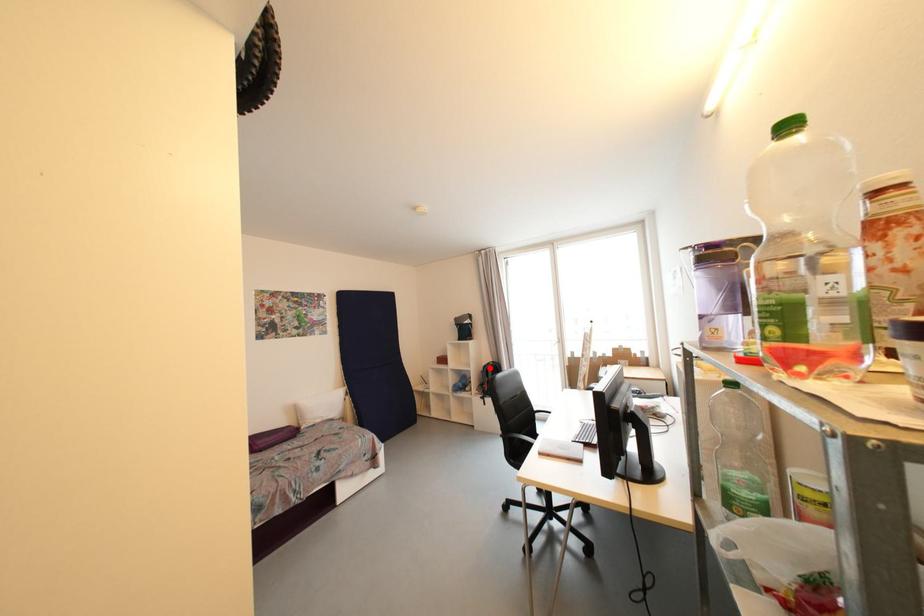
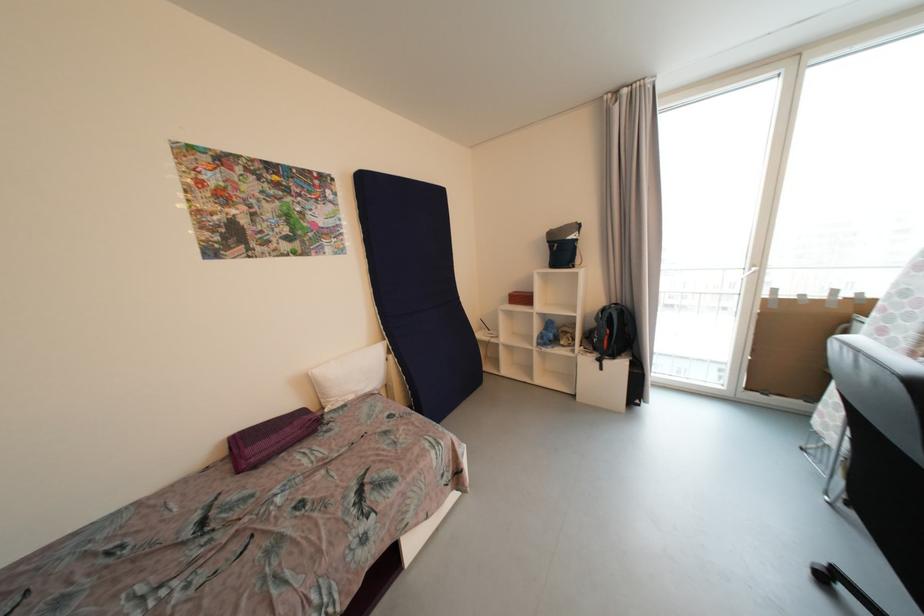
In the second image, find the point that corresponds to the highlighted location in the first image.

(608, 312)